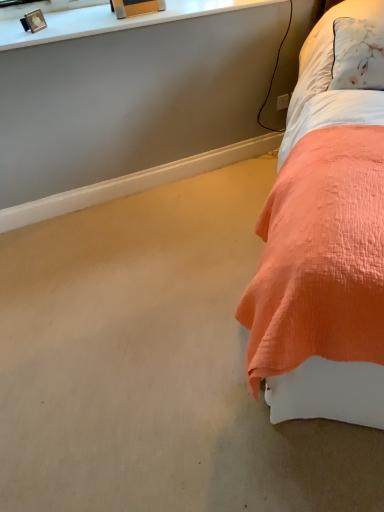
Locate an element on the screen. The height and width of the screenshot is (512, 384). vacant area to the right of metallic gold picture frame at upper left is located at coordinates (76, 30).